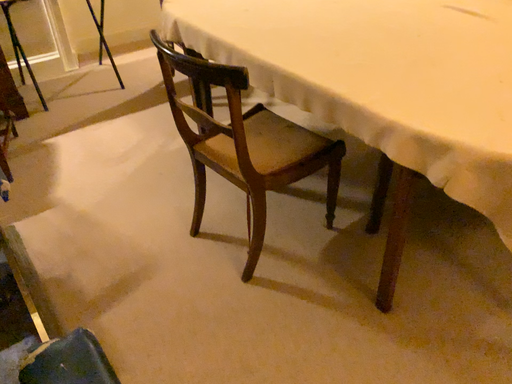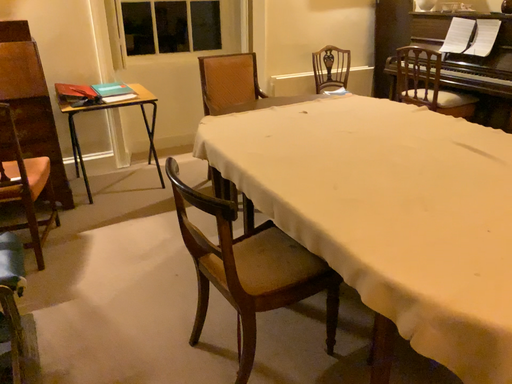
Question: How did the camera likely rotate when shooting the video?

Choices:
 (A) rotated right
 (B) rotated left

Answer: (B)